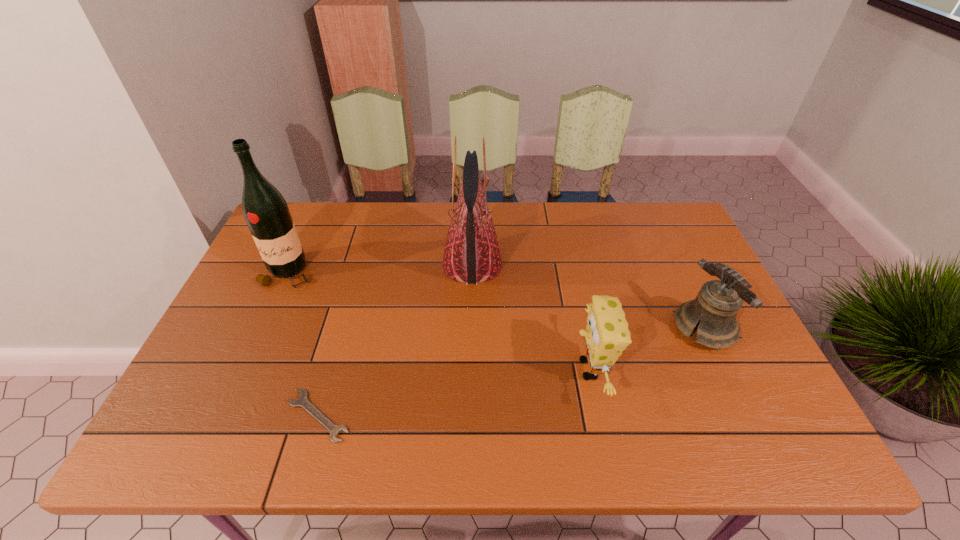
Find the location of `vacant space at the left edge of the desktop`. vacant space at the left edge of the desktop is located at coordinates (263, 272).

The image size is (960, 540). Identify the location of free space at the right edge of the desktop. (681, 259).

Where is `vacant region at the far left corner of the desktop`? This screenshot has height=540, width=960. vacant region at the far left corner of the desktop is located at coordinates (304, 207).

This screenshot has width=960, height=540. Find the location of `vacant space at the near left corner of the desktop`. vacant space at the near left corner of the desktop is located at coordinates (192, 438).

You are a GUI agent. You are given a task and a screenshot of the screen. Output one action in this format:
    pyautogui.click(x=<x>, y=<y>)
    Task: Click on the vacant space at the far right corner of the desktop
    
    Given the screenshot: What is the action you would take?
    pyautogui.click(x=685, y=233)

This screenshot has width=960, height=540. I want to click on free point between the wine bottle and the rightmost object, so click(x=496, y=300).

Identify the location of vacant space that's between the rightmost object and the wrench. (511, 372).

Image resolution: width=960 pixels, height=540 pixels. Identify the location of free space between the shortest object and the second object from right to left. (454, 393).

This screenshot has height=540, width=960. In order to click on vacant region between the rightmost object and the wine bottle in this screenshot , I will do `click(496, 300)`.

The image size is (960, 540). I want to click on vacant space that is in between the sponge and the rightmost object, so click(x=647, y=349).